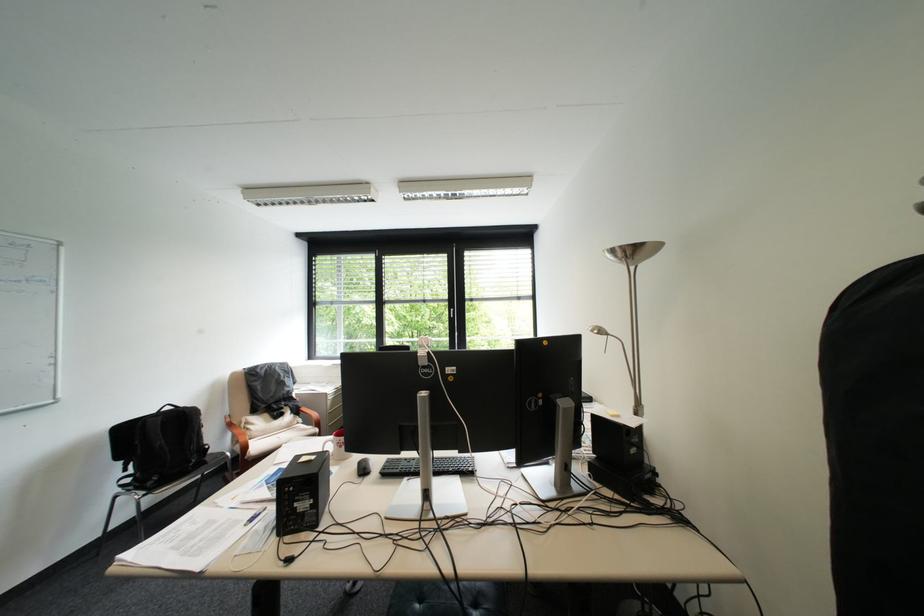
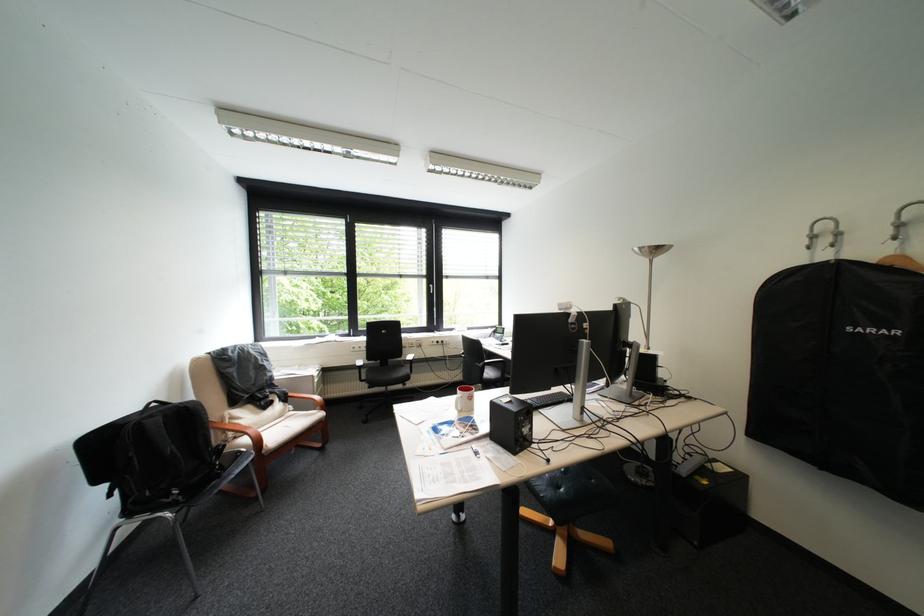
Find the pixel in the second image that matches the point at 296,394 in the first image.

(280, 381)